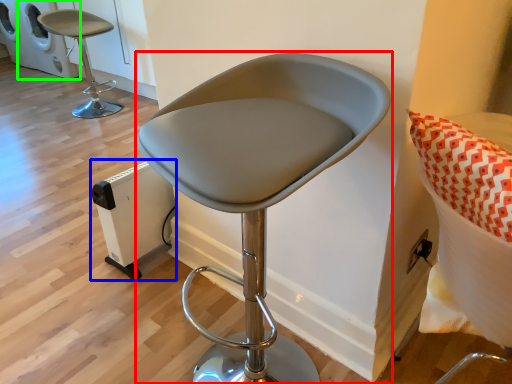
Question: Based on their relative distances, which object is nearer to chair (highlighted by a red box)? Choose from appliance (highlighted by a blue box) and appliance (highlighted by a green box).

Choices:
 (A) appliance
 (B) appliance

Answer: (A)